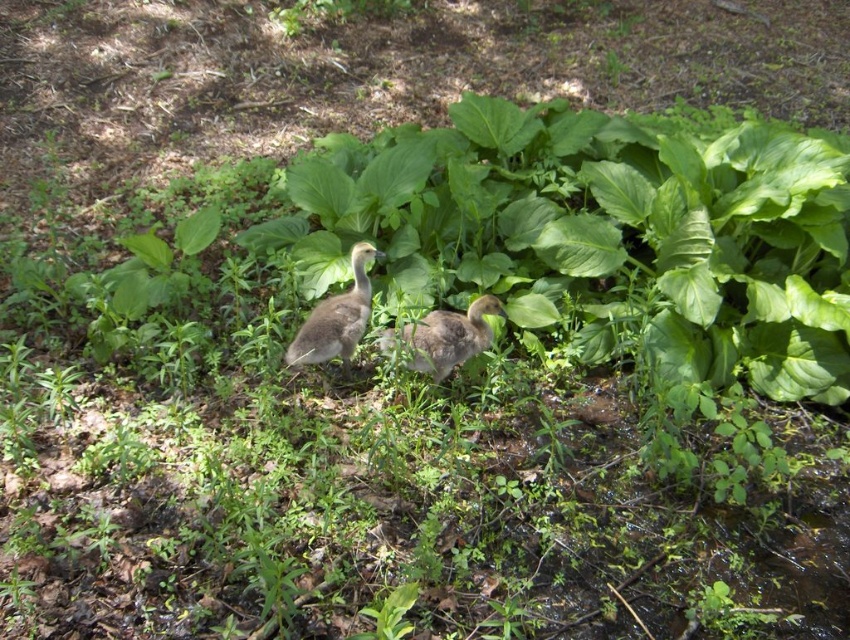
Question: Can you confirm if gray downy duckling at center is positioned below brown downy duckling at center?

Choices:
 (A) yes
 (B) no

Answer: (B)

Question: Among these points, which one is farthest from the camera?

Choices:
 (A) (431, 372)
 (B) (313, 362)

Answer: (A)

Question: Which of the following is the closest to the observer?

Choices:
 (A) gray downy duckling at center
 (B) brown downy duckling at center

Answer: (B)

Question: Can you confirm if gray downy duckling at center is smaller than brown downy duckling at center?

Choices:
 (A) no
 (B) yes

Answer: (A)

Question: Which point appears farthest from the camera in this image?

Choices:
 (A) (457, 326)
 (B) (340, 312)

Answer: (B)

Question: Does gray downy duckling at center have a greater width compared to brown downy duckling at center?

Choices:
 (A) no
 (B) yes

Answer: (A)